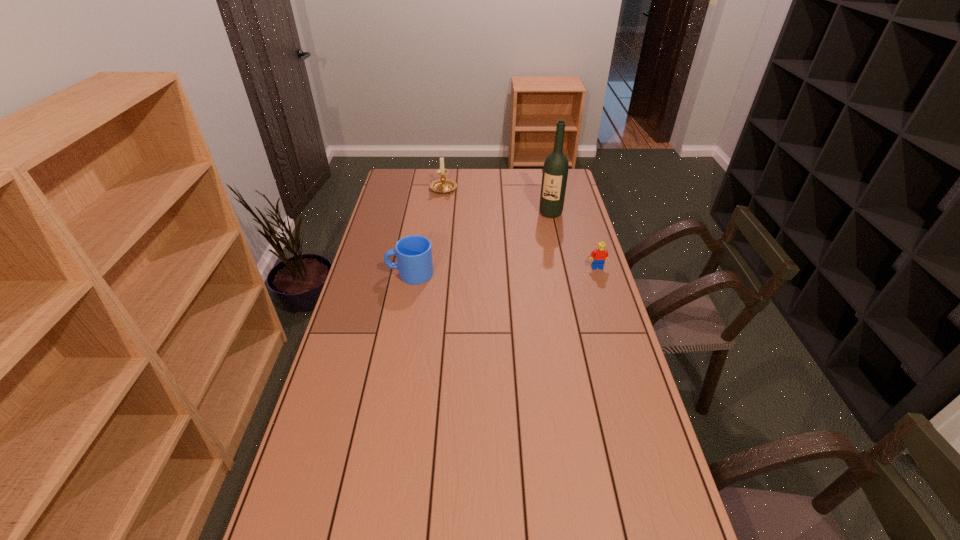
The height and width of the screenshot is (540, 960). I want to click on free space between the candle holder and the third object from left to right, so click(x=497, y=201).

Identify the location of vacant area that lies between the third object from left to right and the rightmost object. (574, 240).

This screenshot has height=540, width=960. Identify the location of free point between the tallest object and the Lego. [x=574, y=240].

Identify the location of free space between the rightmost object and the mug. (504, 271).

The width and height of the screenshot is (960, 540). Identify the location of object that can be found as the closest to the mug. [x=442, y=185].

Locate an element on the screen. This screenshot has height=540, width=960. object that is the third closest one to the rightmost object is located at coordinates (442, 185).

At what (x,y) coordinates should I click in order to perform the action: click on free spot that satisfies the following two spatial constraints: 1. on the front side of the tallest object; 2. on the right side of the candle holder. Please return your answer as a coordinate pair (x, y). Looking at the image, I should click on (441, 213).